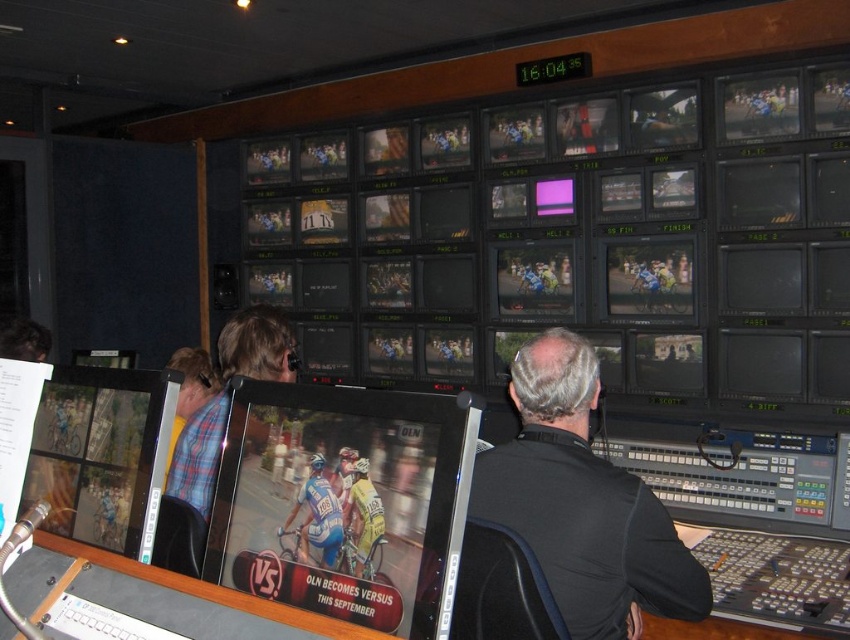
You are a technician in the control room. You need to adjust the settings of the shiny plastic monitor at center, but you also see the yellow jersey at center in your line of sight. Which object is closer to you, the technician?

The shiny plastic monitor at center is closer to you because it is in front of the yellow jersey at center.

You are a technician in the control room and need to adjust the settings on both the shiny plastic monitor at center and the black matte monitor at center. Which monitor should you approach first to reach the one closer to you?

You should approach the shiny plastic monitor at center first since it is closer to the viewer than the black matte monitor at center.

You are standing in the control room and need to adjust the camera to focus on the point at coordinates point [355,612]. The camera has a focal length of 35 mm. Can you estimate whether the camera is within the required distance to capture the point clearly, considering the standard focusing distance for a 35 mm lens is typically around 34 inches?

The point at coordinates point [355,612] is 34.44 inches away from the camera. Since the standard focusing distance for a 35 mm lens is around 34 inches, the camera is slightly beyond the optimal distance but still within a reasonable range to capture the point clearly.